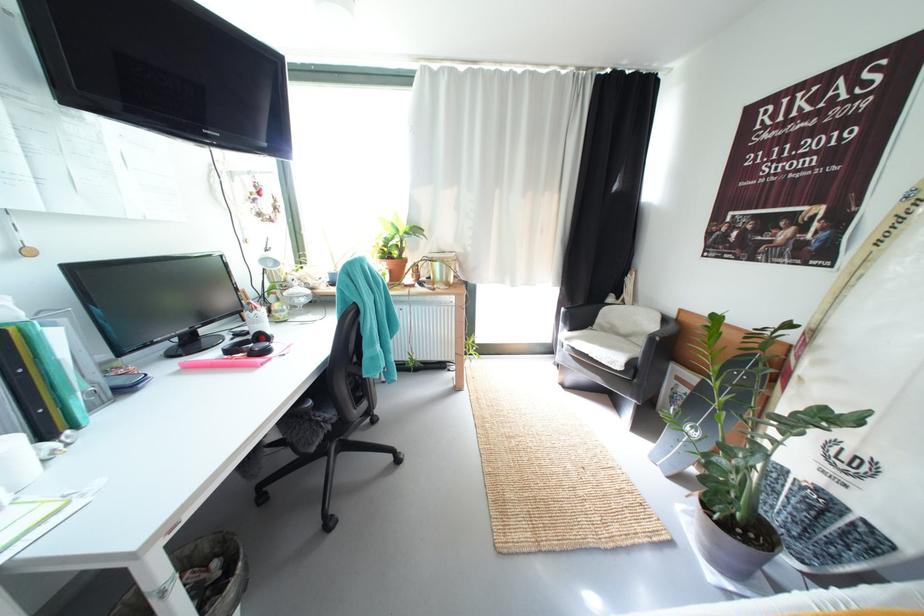
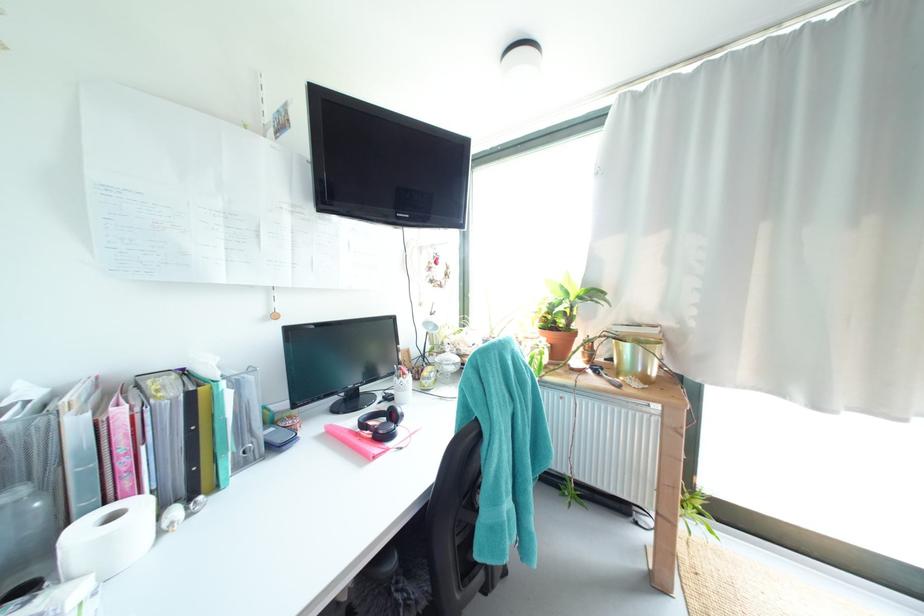
Locate, in the second image, the point that corresponds to the point at 260,312 in the first image.

(407, 379)